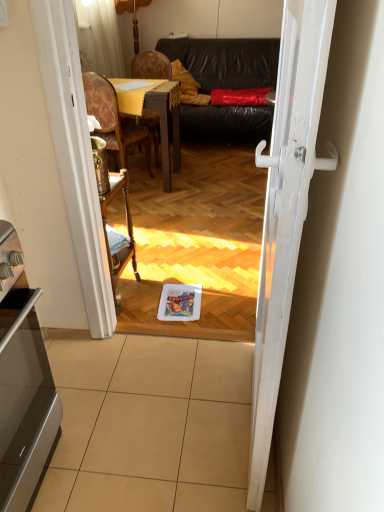
Question: Is beige tile at lower center at the right side of leather couch at center?

Choices:
 (A) yes
 (B) no

Answer: (B)

Question: Does beige tile at lower center have a smaller size compared to leather couch at center?

Choices:
 (A) no
 (B) yes

Answer: (B)

Question: From a real-world perspective, is beige tile at lower center below leather couch at center?

Choices:
 (A) yes
 (B) no

Answer: (A)

Question: From the image's perspective, is beige tile at lower center located above leather couch at center?

Choices:
 (A) no
 (B) yes

Answer: (A)

Question: Is beige tile at lower center aimed at leather couch at center?

Choices:
 (A) yes
 (B) no

Answer: (B)

Question: Considering their positions, is satin silver oven at lower left located in front of or behind leather couch at center?

Choices:
 (A) behind
 (B) front

Answer: (B)

Question: Does point (4, 366) appear closer or farther from the camera than point (278, 40)?

Choices:
 (A) closer
 (B) farther

Answer: (A)

Question: Would you say satin silver oven at lower left is inside or outside leather couch at center?

Choices:
 (A) inside
 (B) outside

Answer: (B)

Question: Is satin silver oven at lower left taller or shorter than leather couch at center?

Choices:
 (A) short
 (B) tall

Answer: (A)

Question: From a real-world perspective, is satin silver oven at lower left positioned above or below beige tile at lower center?

Choices:
 (A) above
 (B) below

Answer: (A)

Question: Considering their positions, is satin silver oven at lower left located in front of or behind beige tile at lower center?

Choices:
 (A) behind
 (B) front

Answer: (B)

Question: Is satin silver oven at lower left wider or thinner than beige tile at lower center?

Choices:
 (A) thin
 (B) wide

Answer: (A)

Question: In the image, is satin silver oven at lower left on the left side or the right side of beige tile at lower center?

Choices:
 (A) right
 (B) left

Answer: (B)

Question: Relative to woodenchair at center, placed as the 1th chair when sorted from front to back, is woodenmaterial/texturetable at upper center in front or behind?

Choices:
 (A) front
 (B) behind

Answer: (B)

Question: From the image's perspective, is woodenmaterial/texturetable at upper center positioned above or below woodenchair at center, marked as the 2th chair in a back-to-front arrangement?

Choices:
 (A) below
 (B) above

Answer: (A)